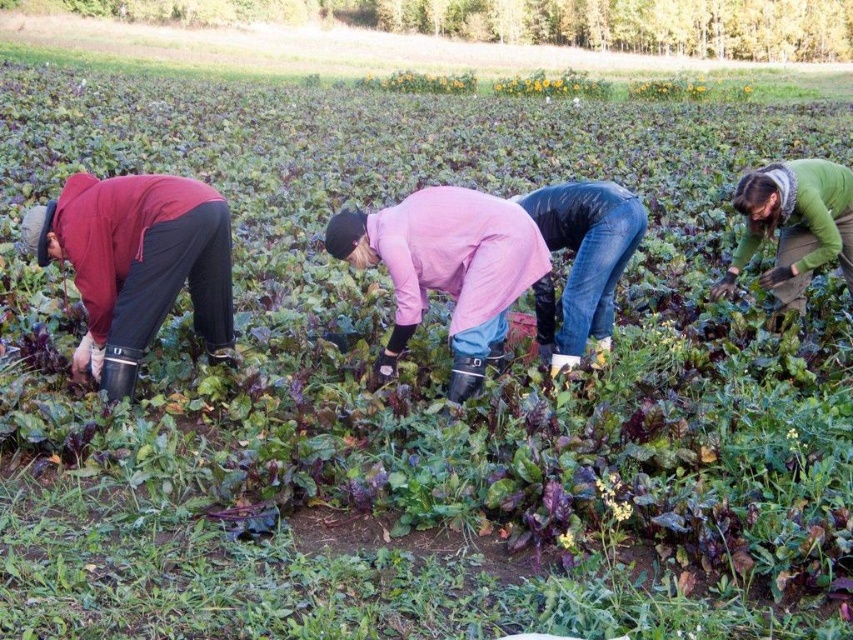
Question: Which of the following is the farthest from the observer?

Choices:
 (A) (576, 212)
 (B) (207, 211)
 (C) (471, 392)
 (D) (798, 172)

Answer: (D)

Question: Among these objects, which one is nearest to the camera?

Choices:
 (A) matte red jacket at left
 (B) pink matte jacket at center

Answer: (A)

Question: Is matte red jacket at left to the right of green matte jacket at right from the viewer's perspective?

Choices:
 (A) yes
 (B) no

Answer: (B)

Question: Which point is closer to the camera?

Choices:
 (A) (828, 200)
 (B) (143, 337)

Answer: (B)

Question: Is matte red jacket at left closer to the viewer compared to pink matte jacket at center?

Choices:
 (A) yes
 (B) no

Answer: (A)

Question: Is matte red jacket at left below pink matte jacket at center?

Choices:
 (A) no
 (B) yes

Answer: (A)